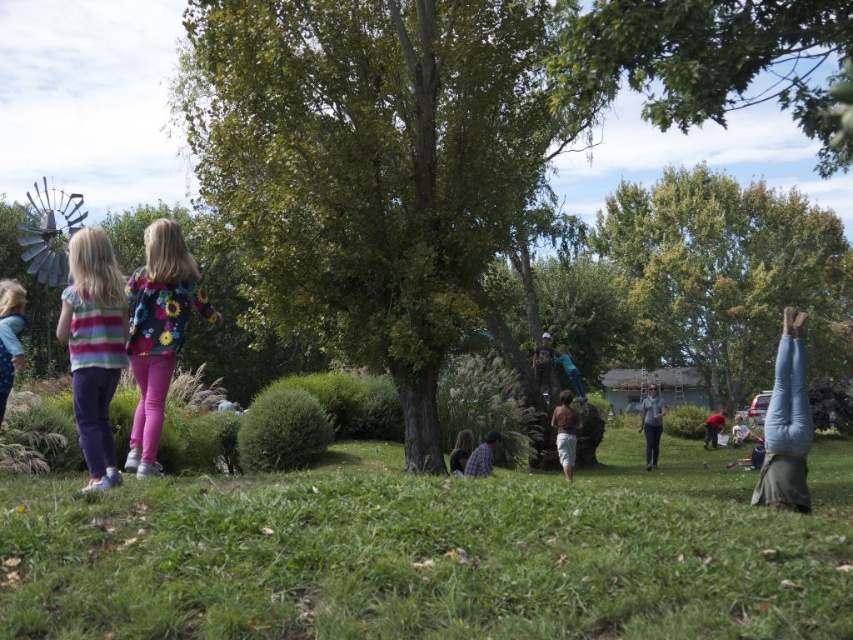
Is striped fabric shirt at left wider than camouflage fabric backpack at center?

Yes.

Based on the photo, is striped fabric shirt at left below camouflage fabric backpack at center?

No.

Who is more distant from viewer, (97, 468) or (537, 372)?

The point (537, 372) is behind.

What are the coordinates of `striped fabric shirt at left` in the screenshot? It's located at (93, 346).

Which of these two, jeans at lower right or plaid shirt at center, stands shorter?

Standing shorter between the two is plaid shirt at center.

Can you confirm if jeans at lower right is shorter than plaid shirt at center?

No, jeans at lower right is not shorter than plaid shirt at center.

What do you see at coordinates (786, 426) in the screenshot? Image resolution: width=853 pixels, height=640 pixels. I see `jeans at lower right` at bounding box center [786, 426].

Where is `jeans at lower right`? The image size is (853, 640). jeans at lower right is located at coordinates (786, 426).

Does point (608, 40) come behind point (560, 419)?

No, (608, 40) is in front of (560, 419).

Is the position of green leafy tree at upper center more distant than that of brown cotton shirt at center?

No, it is in front of brown cotton shirt at center.

This screenshot has width=853, height=640. Identify the location of green leafy tree at upper center. (714, 61).